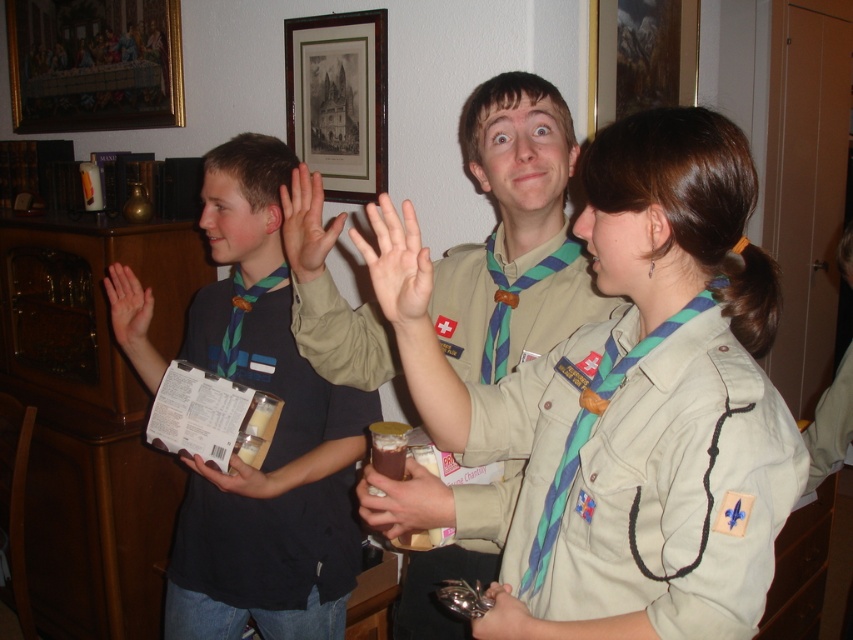
Consider the image. Can you confirm if matte beige hand at center is wider than smooth plastic cup at center?

Incorrect, matte beige hand at center's width does not surpass smooth plastic cup at center's.

Consider the image. Who is positioned more to the right, matte beige hand at center or smooth plastic cup at center?

smooth plastic cup at center is more to the right.

This screenshot has height=640, width=853. I want to click on matte beige hand at center, so tap(398, 269).

Is matte black shirt at left positioned in front of matte black hand at upper left?

That is True.

Does matte black shirt at left lie behind matte black hand at upper left?

No, it is in front of matte black hand at upper left.

Is point (341, 550) positioned in front of point (143, 362)?

Yes, point (341, 550) is closer to viewer.

You are a GUI agent. You are given a task and a screenshot of the screen. Output one action in this format:
    pyautogui.click(x=<x>, y=<y>)
    Task: Click on the matte black shirt at left
    This screenshot has width=853, height=640.
    Given the screenshot: What is the action you would take?
    pyautogui.click(x=274, y=435)

Which is behind, point (434, 476) or point (129, 340)?

The point (129, 340) is behind.

Does point (421, 477) come behind point (148, 364)?

No, it is in front of (148, 364).

Who is more forward, (384, 524) or (115, 268)?

Point (384, 524)

You are a GUI agent. You are given a task and a screenshot of the screen. Output one action in this format:
    pyautogui.click(x=<x>, y=<y>)
    Task: Click on the smooth plastic cup at center
    The image size is (853, 640).
    Given the screenshot: What is the action you would take?
    pyautogui.click(x=405, y=500)